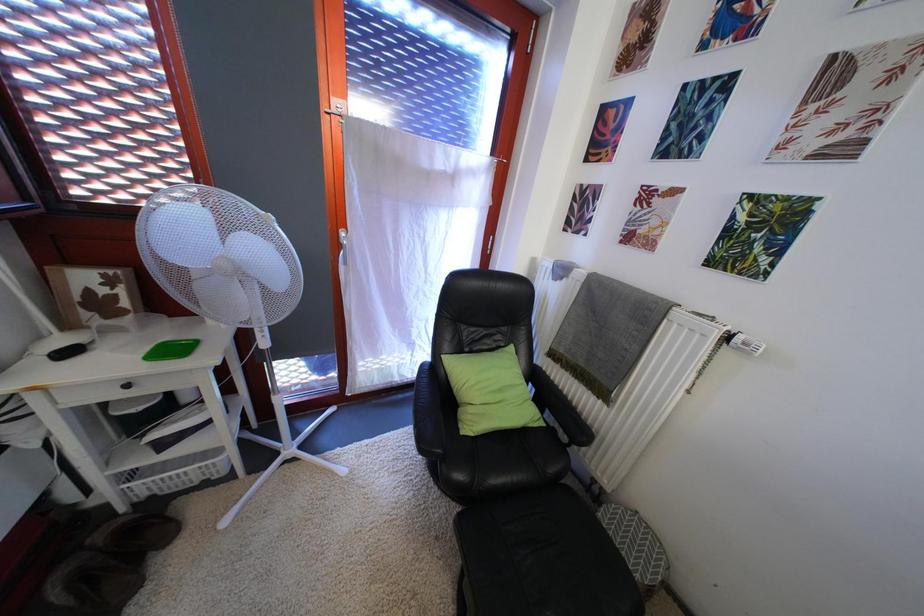
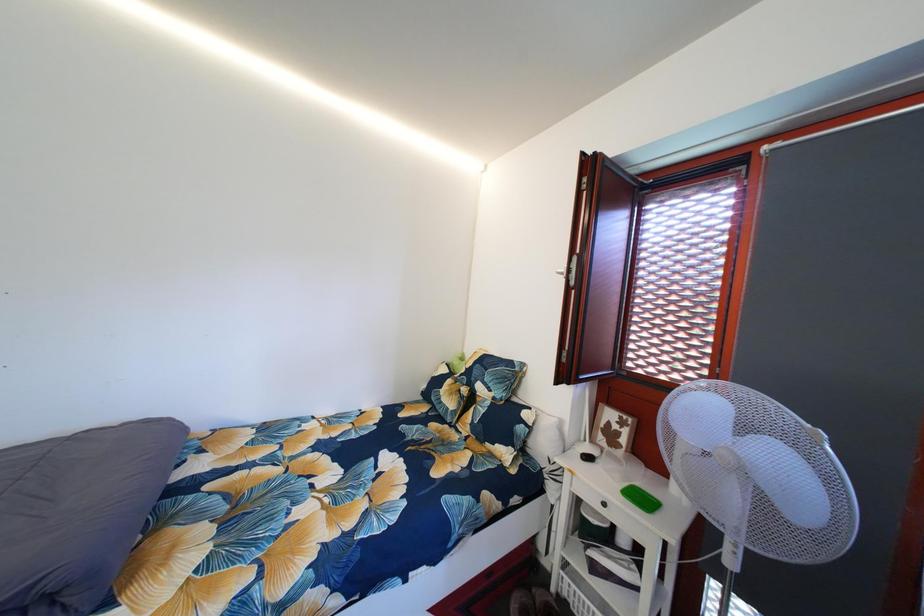
Question: The images are taken continuously from a first-person perspective. In which direction is your viewpoint rotating?

Choices:
 (A) Left
 (B) Right
 (C) Up
 (D) Down

Answer: (A)